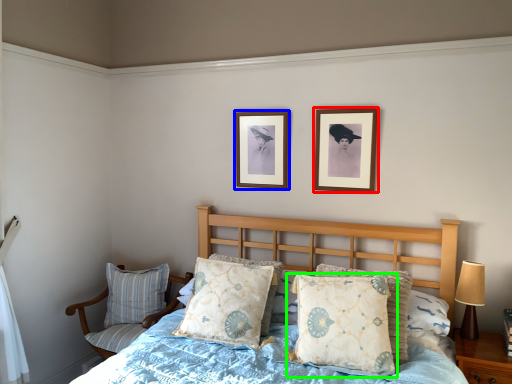
Question: Which object is the closest to the picture frame (highlighted by a red box)? Choose among these: picture frame (highlighted by a blue box) or pillow (highlighted by a green box).

Choices:
 (A) picture frame
 (B) pillow

Answer: (A)